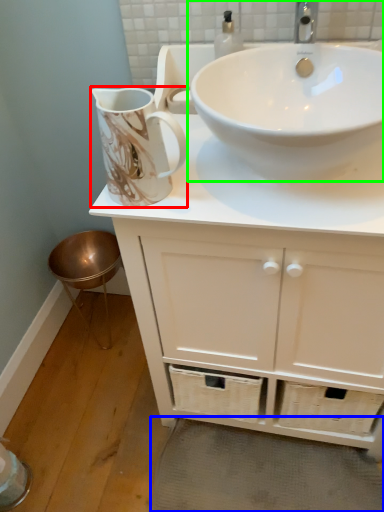
Question: Estimate the real-world distances between objects in this image. Which object is farther from jug (highlighted by a red box), bath mat (highlighted by a blue box) or sink (highlighted by a green box)?

Choices:
 (A) bath mat
 (B) sink

Answer: (A)